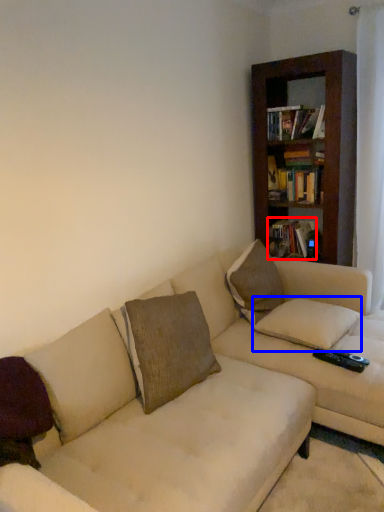
Question: Which object appears closest to the camera in this image, book (highlighted by a red box) or pillow (highlighted by a blue box)?

Choices:
 (A) book
 (B) pillow

Answer: (B)